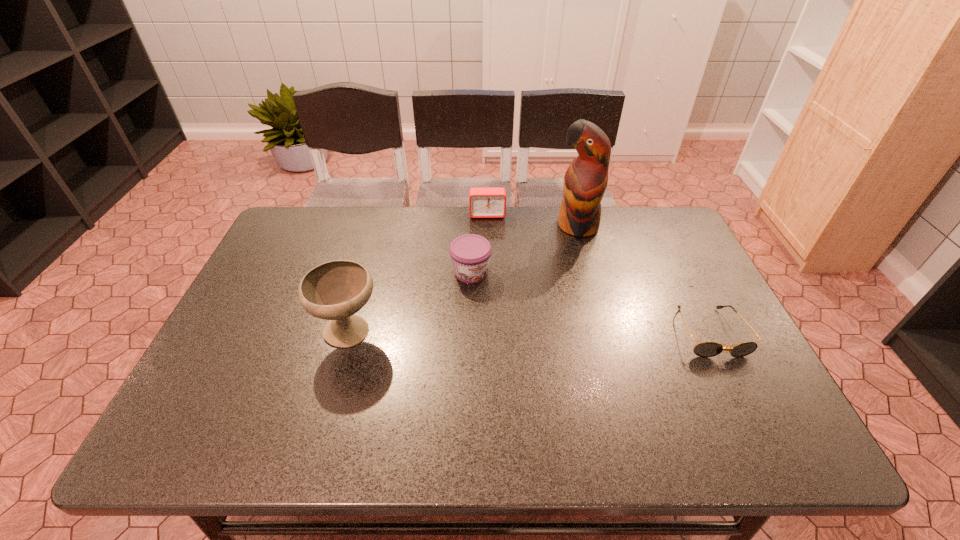
This screenshot has height=540, width=960. Identify the location of parrot positioned at the far edge. (585, 181).

This screenshot has width=960, height=540. What are the coordinates of `object positioned at the right edge` in the screenshot? It's located at (705, 349).

This screenshot has height=540, width=960. In the image, there is a desktop. Find the location of `vacant space at the far edge`. vacant space at the far edge is located at coordinates (635, 246).

Identify the location of free spot at the near edge of the desktop. This screenshot has width=960, height=540. (320, 386).

Where is `blank area at the left edge`? blank area at the left edge is located at coordinates (222, 373).

What are the coordinates of `free space at the right edge of the desktop` in the screenshot? It's located at (704, 273).

Identify the location of free space at the far right corner of the desktop. The image size is (960, 540). (631, 207).

Where is `free space at the near right corner of the desktop`? The width and height of the screenshot is (960, 540). free space at the near right corner of the desktop is located at coordinates (736, 400).

You are a GUI agent. You are given a task and a screenshot of the screen. Output one action in this format:
    pyautogui.click(x=<x>, y=<y>)
    Task: Click on the free space between the third farthest object and the second tallest object
    Image resolution: width=960 pixels, height=540 pixels.
    Given the screenshot: What is the action you would take?
    pyautogui.click(x=410, y=303)

Locate an element on the screen. vacant space in between the chalice and the alarm clock is located at coordinates (419, 274).